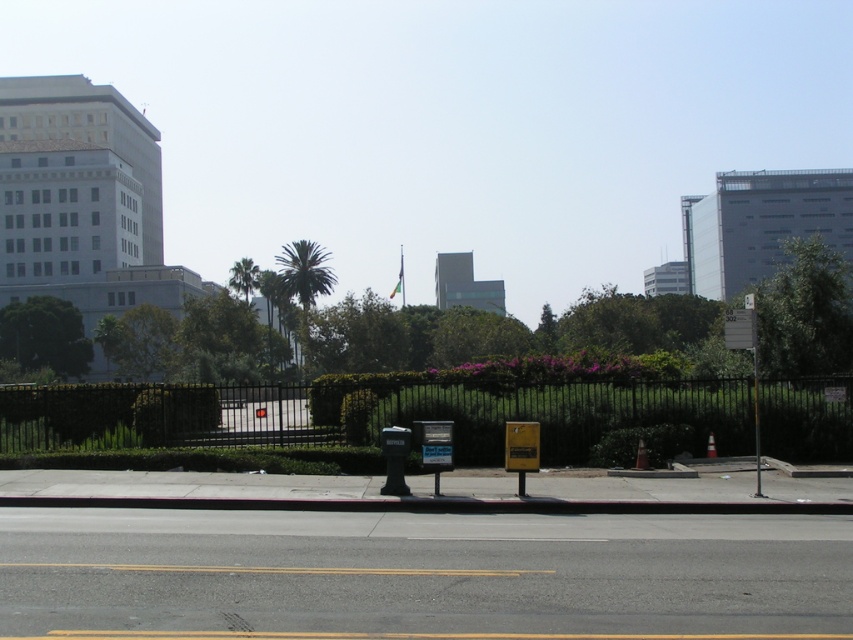
Does green leafy tree at upper right appear over black plastic parking meter at center?

Yes.

Does green leafy tree at upper right come behind black plastic parking meter at center?

Yes.

Does point (766, 333) lie in front of point (387, 492)?

No, it is not.

The height and width of the screenshot is (640, 853). In order to click on green leafy tree at upper right in this screenshot , I will do `click(805, 310)`.

Is green leafy hedge at left wider than green leafy tree at left?

Incorrect, green leafy hedge at left's width does not surpass green leafy tree at left's.

Which of these two, green leafy hedge at left or green leafy tree at left, stands taller?

With more height is green leafy tree at left.

Between point (28, 419) and point (49, 358), which one is positioned in front?

Point (28, 419)

At what (x,y) coordinates should I click in order to perform the action: click on green leafy hedge at left. Please return your answer as a coordinate pair (x, y). The width and height of the screenshot is (853, 640). Looking at the image, I should click on pos(103,413).

Does green leafy tree at upper right have a greater height compared to green leafy tree at left?

Yes.

Is point (827, 324) positioned before point (51, 326)?

Yes, point (827, 324) is closer to viewer.

Image resolution: width=853 pixels, height=640 pixels. In order to click on green leafy tree at upper right in this screenshot , I will do `click(805, 310)`.